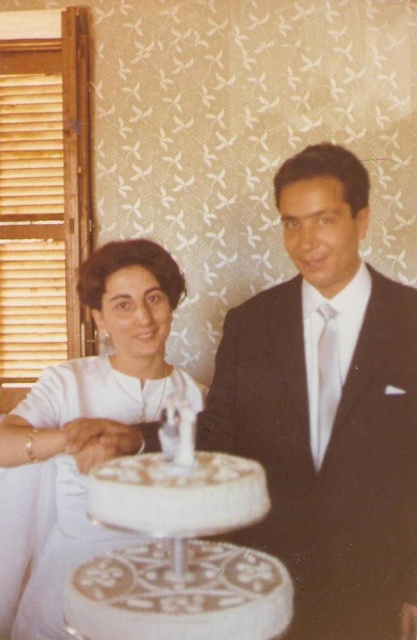
You are a photographer at a wedding reception and need to capture a clear shot of both the white frosted cake at center and the white satin dress at center. Since the cake is in front of the dress, will the dress be partially obscured in the photo?

Yes, the white satin dress at center will be partially obscured because the white frosted cake at center is positioned in front of it, blocking part of the dress from view.

You are standing in the room and want to take a photo of the two points. Which point, point [236,584] or point [102,531], will appear larger in your photo?

Point [236,584] will appear larger in the photo because it is closer to the camera than point [102,531].